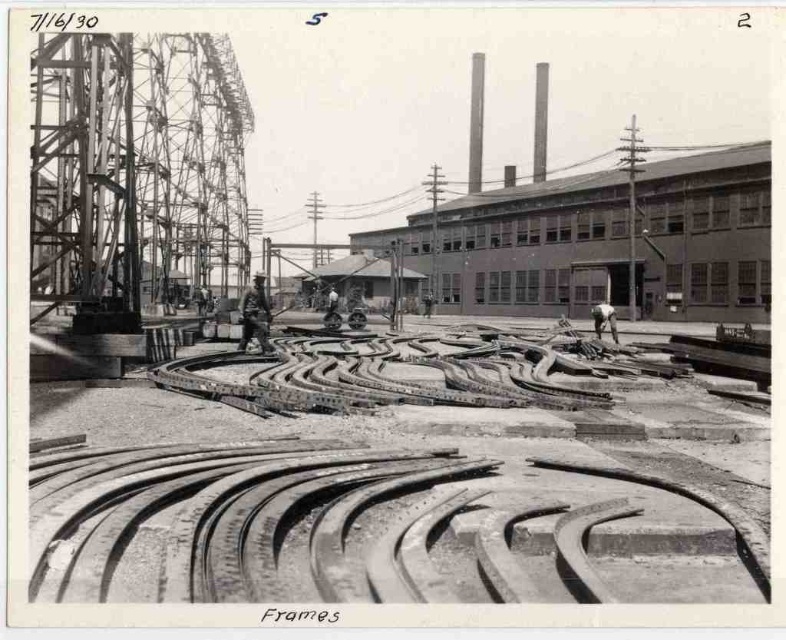
Question: Does smooth concrete frames at center come in front of dark gray uniform at center?

Choices:
 (A) no
 (B) yes

Answer: (B)

Question: Is smooth concrete frames at center smaller than dark gray uniform at center?

Choices:
 (A) yes
 (B) no

Answer: (A)

Question: Can you confirm if smooth concrete frames at center is thinner than dark gray uniform at center?

Choices:
 (A) yes
 (B) no

Answer: (B)

Question: Which of the following is the closest to the observer?

Choices:
 (A) (263, 310)
 (B) (72, 465)

Answer: (B)

Question: Which of the following is the farthest from the observer?

Choices:
 (A) dark gray uniform at center
 (B) smooth concrete frames at center

Answer: (A)

Question: Which point is closer to the camera taking this photo?

Choices:
 (A) (254, 296)
 (B) (186, 554)

Answer: (B)